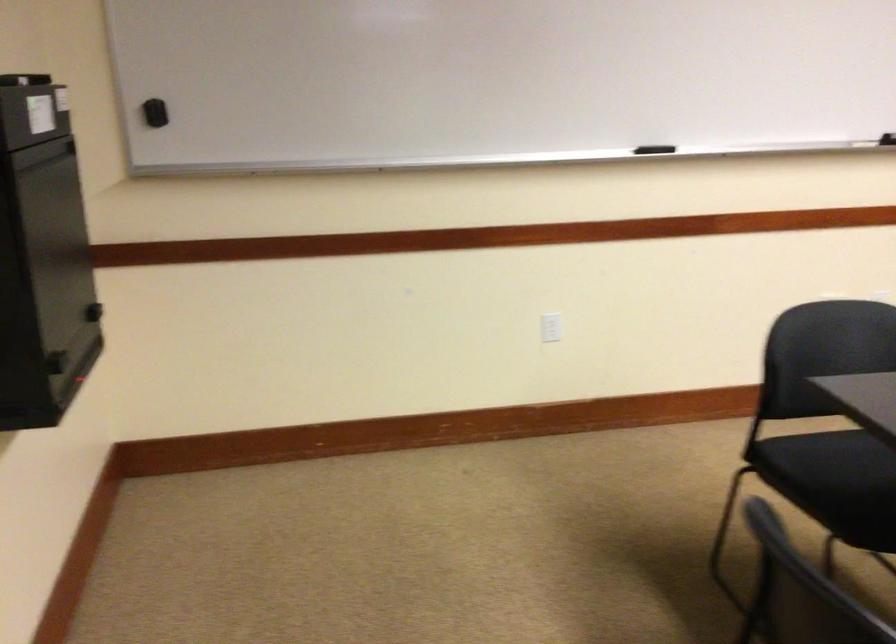
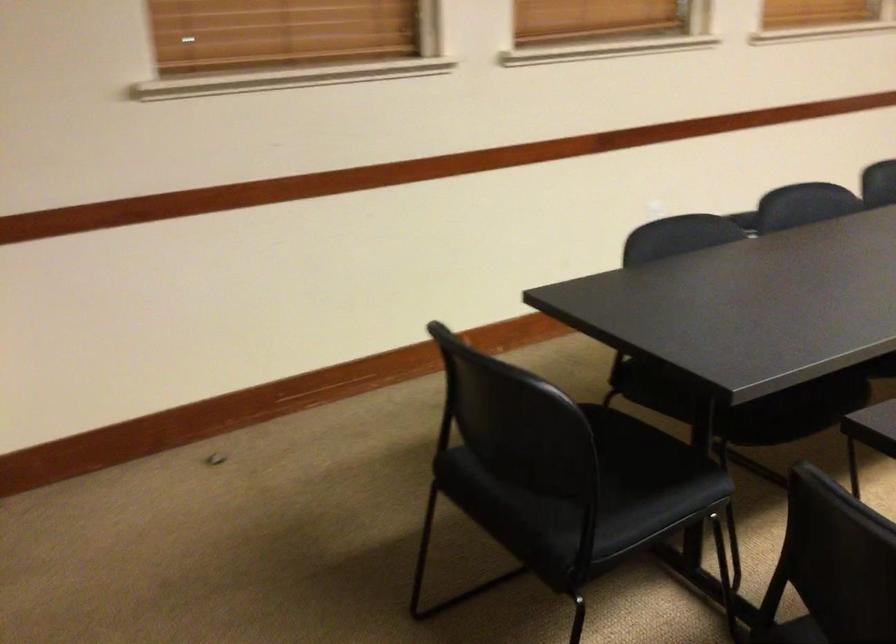
Question: Which direction would the cameraman need to move to produce the second image? Reply with the corresponding letter.

Choices:
 (A) Left
 (B) Right
 (C) Forward
 (D) Backward

Answer: (D)